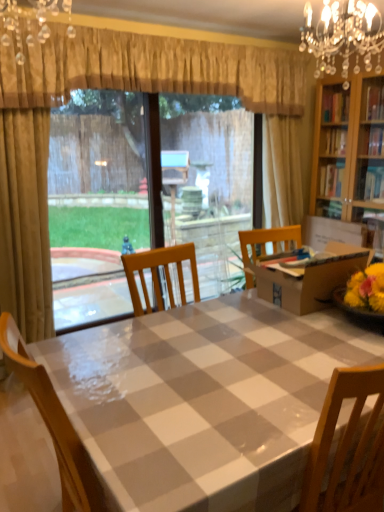
Identify the location of free area below crystal glass chandelier at upper center, placed as the 1th light fixture when sorted from front to back (from a real-world perspective). (64, 350).